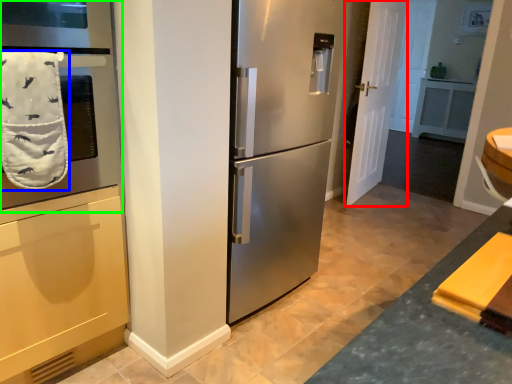
Question: Which object is the closest to the door (highlighted by a red box)? Choose among these: bath towel (highlighted by a blue box) or oven (highlighted by a green box).

Choices:
 (A) bath towel
 (B) oven

Answer: (B)